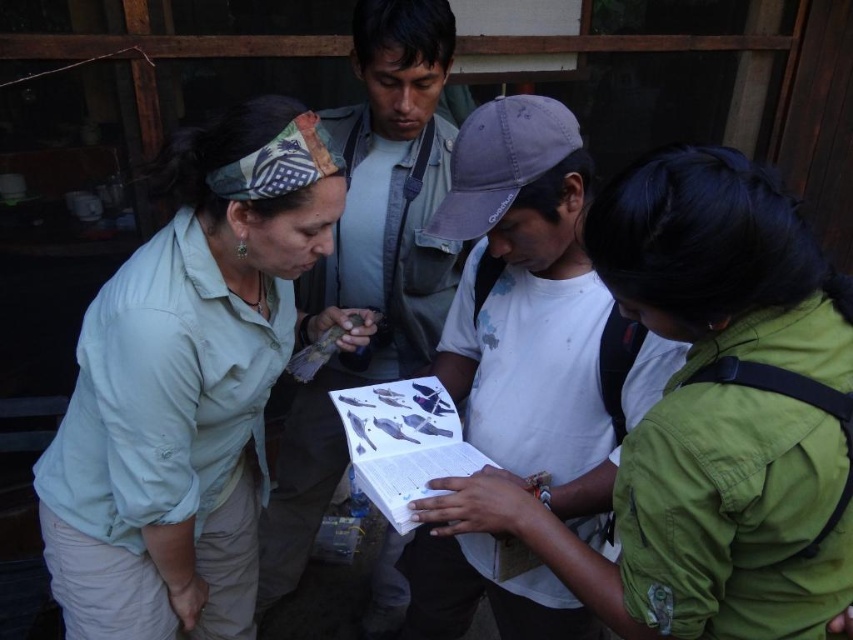
Question: Is green matte jacket at center smaller than matte gray shirt at center?

Choices:
 (A) no
 (B) yes

Answer: (B)

Question: Which object is positioned farthest from the green matte jacket at center?

Choices:
 (A) matte gray shirt at center
 (B) matte green shirt at center

Answer: (A)

Question: Can you confirm if green matte jacket at center is positioned above matte gray shirt at center?

Choices:
 (A) yes
 (B) no

Answer: (B)

Question: Which point is closer to the camera taking this photo?

Choices:
 (A) (280, 520)
 (B) (86, 509)
 (C) (730, 419)

Answer: (C)

Question: Considering the real-world distances, which object is closest to the green matte jacket at center?

Choices:
 (A) matte green shirt at center
 (B) matte gray shirt at center

Answer: (A)

Question: Can you confirm if green matte jacket at center is positioned to the right of matte gray shirt at center?

Choices:
 (A) yes
 (B) no

Answer: (A)